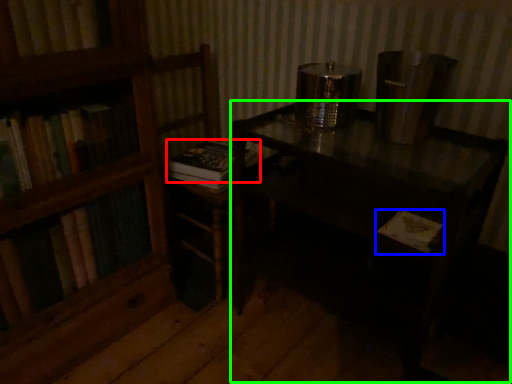
Question: Which object is the farthest from book (highlighted by a red box)? Choose among these: book (highlighted by a blue box) or table (highlighted by a green box).

Choices:
 (A) book
 (B) table

Answer: (A)